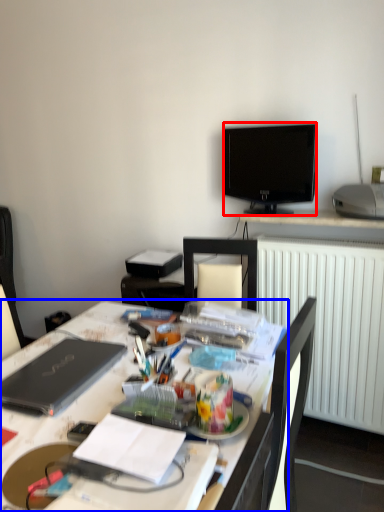
Question: Which of the following is the closest to the observer, television (highlighted by a red box) or desk (highlighted by a blue box)?

Choices:
 (A) television
 (B) desk

Answer: (B)